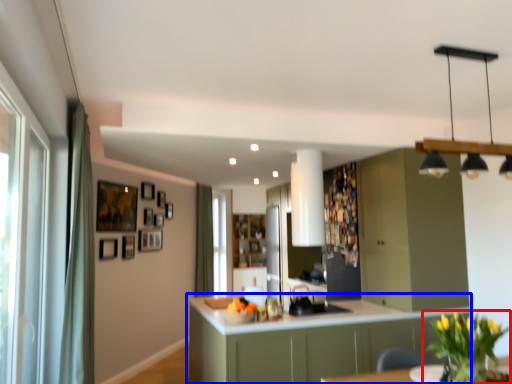
Question: Which point is closer to the camera, houseplant (highlighted by a red box) or cabinetry (highlighted by a blue box)?

Choices:
 (A) houseplant
 (B) cabinetry

Answer: (A)